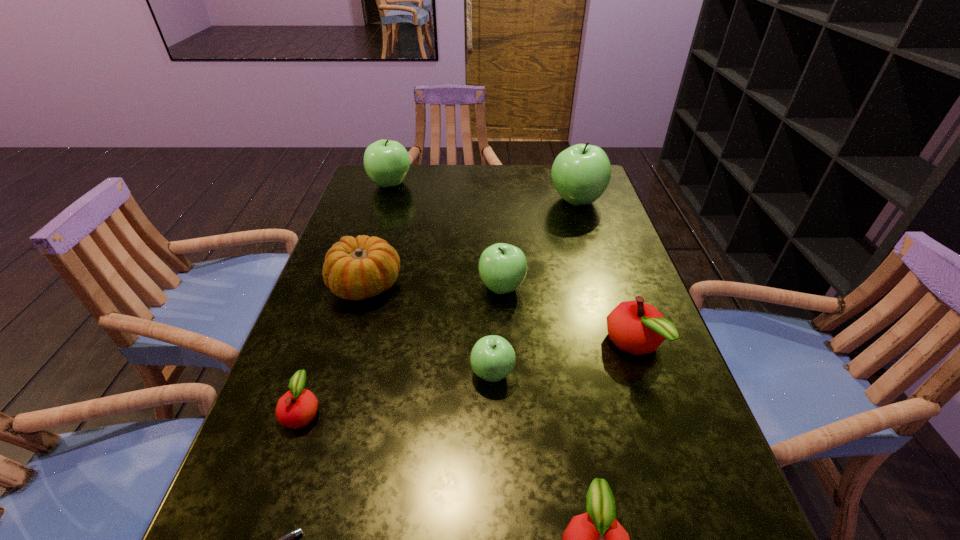
The height and width of the screenshot is (540, 960). I want to click on free spot between the smallest green apple and the tallest apple, so click(535, 287).

I want to click on the fourth closest object relative to the shortest object, so click(357, 268).

At what (x,y) coordinates should I click in order to perform the action: click on object that ranks as the third closest to the farthest red apple. Please return your answer as a coordinate pair (x, y). The width and height of the screenshot is (960, 540). Looking at the image, I should click on (595, 539).

In order to click on apple that is the second closest one to the nearest green apple in this screenshot , I will do click(x=636, y=327).

Find the location of a particular element. The height and width of the screenshot is (540, 960). apple that is the second closest to the gourd is located at coordinates (296, 408).

Select which green apple is the fourth closest to the gourd. Please provide its 2D coordinates. Your answer should be formatted as a tuple, i.e. [(x, y)], where the tuple contains the x and y coordinates of a point satisfying the conditions above.

[(581, 173)]

Select which green apple is the second closest to the nearest green apple. Please provide its 2D coordinates. Your answer should be formatted as a tuple, i.e. [(x, y)], where the tuple contains the x and y coordinates of a point satisfying the conditions above.

[(581, 173)]

Identify the location of red apple that is the second closest one to the biggest red apple. The height and width of the screenshot is (540, 960). (296, 408).

Locate an element on the screen. The image size is (960, 540). red apple identified as the third closest to the third farthest green apple is located at coordinates (595, 539).